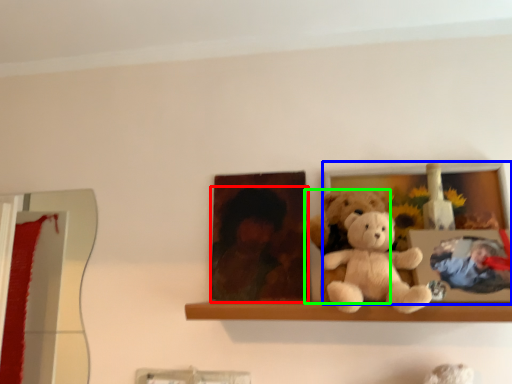
Question: Estimate the real-world distances between objects in this image. Which object is farther from person (highlighted by a red box), picture frame (highlighted by a blue box) or teddy bear (highlighted by a green box)?

Choices:
 (A) picture frame
 (B) teddy bear

Answer: (A)